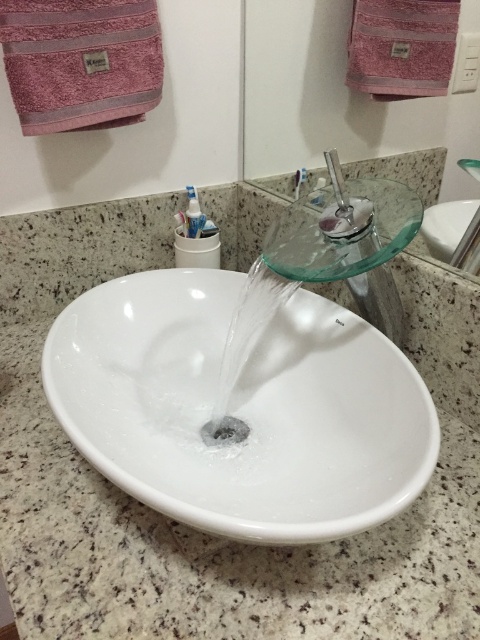
Is transparent glass faucet at center positioned in front of black metallic drain at center?

Yes.

Which is behind, point (357, 241) or point (216, 432)?

The point (216, 432) is more distant.

Locate an element on the screen. The width and height of the screenshot is (480, 640). transparent glass faucet at center is located at coordinates click(x=348, y=243).

Can you confirm if white glossy sink at center is wider than transparent glass faucet at center?

Yes, white glossy sink at center is wider than transparent glass faucet at center.

Identify the location of white glossy sink at center. click(x=240, y=408).

Which is behind, point (90, 323) or point (202, 428)?

Point (90, 323)

Based on the photo, which of these two, white glossy sink at center or black metallic drain at center, stands taller?

white glossy sink at center is taller.

In order to click on white glossy sink at center in this screenshot , I will do `click(240, 408)`.

Where is `white glossy sink at center`? This screenshot has height=640, width=480. white glossy sink at center is located at coordinates (240, 408).